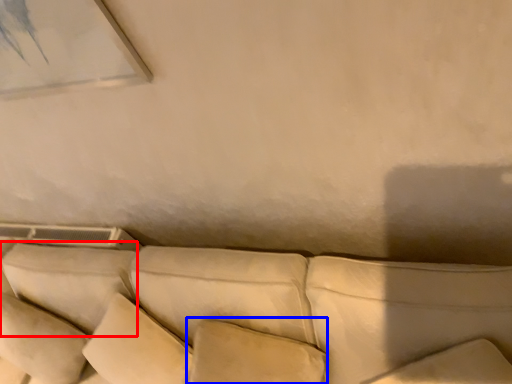
Question: Which object is further to the camera taking this photo, pillow (highlighted by a red box) or pillow (highlighted by a blue box)?

Choices:
 (A) pillow
 (B) pillow

Answer: (A)